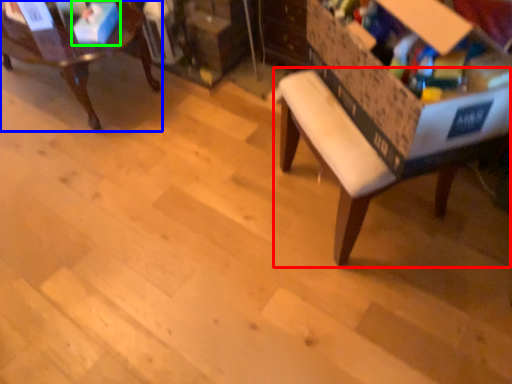
Question: Estimate the real-world distances between objects in this image. Which object is closer to table (highlighted by a red box), chair (highlighted by a blue box) or storage box (highlighted by a green box)?

Choices:
 (A) chair
 (B) storage box

Answer: (B)